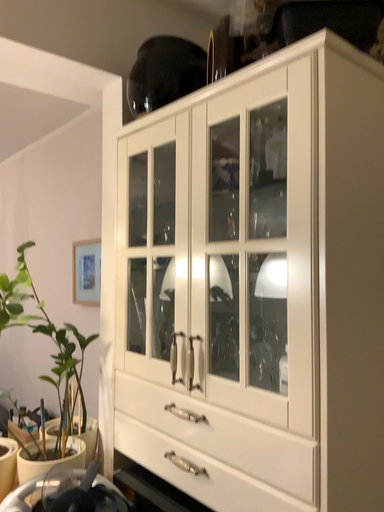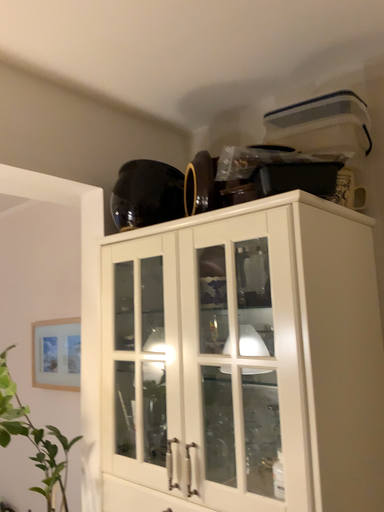
Question: How did the camera likely rotate when shooting the video?

Choices:
 (A) rotated right
 (B) rotated left

Answer: (A)